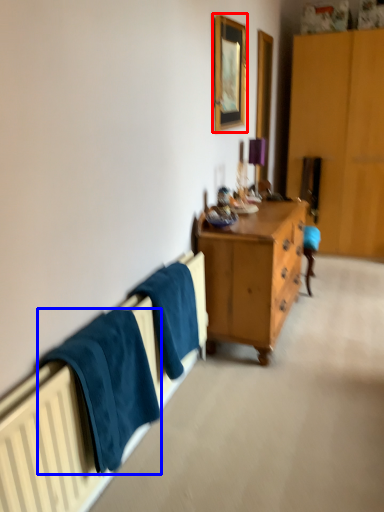
Question: Which point is further to the camera, picture frame (highlighted by a red box) or towel/napkin (highlighted by a blue box)?

Choices:
 (A) picture frame
 (B) towel/napkin

Answer: (A)